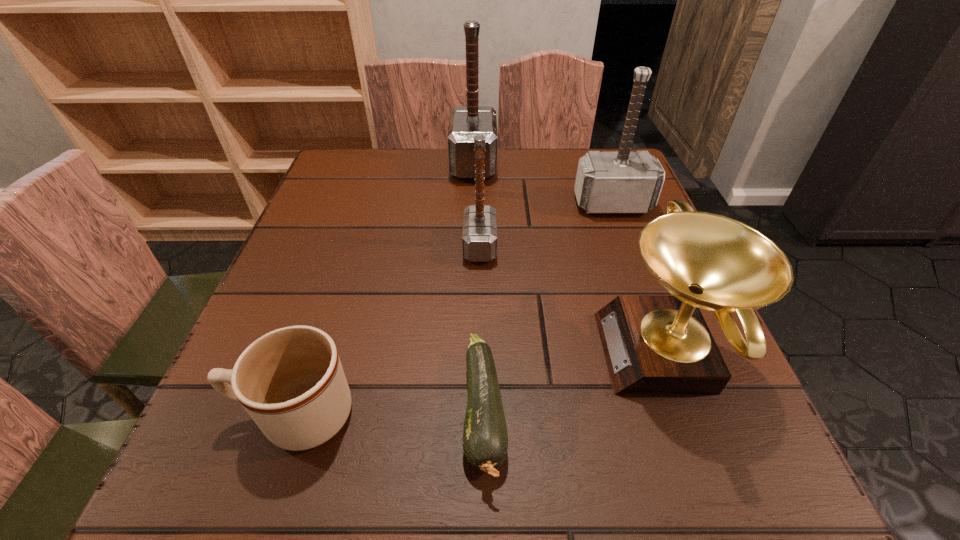
In order to click on free space that satisfies the following two spatial constraints: 1. for striking with the head of the second farthest hammer; 2. on the front-facing side of the award in this screenshot , I will do `click(668, 353)`.